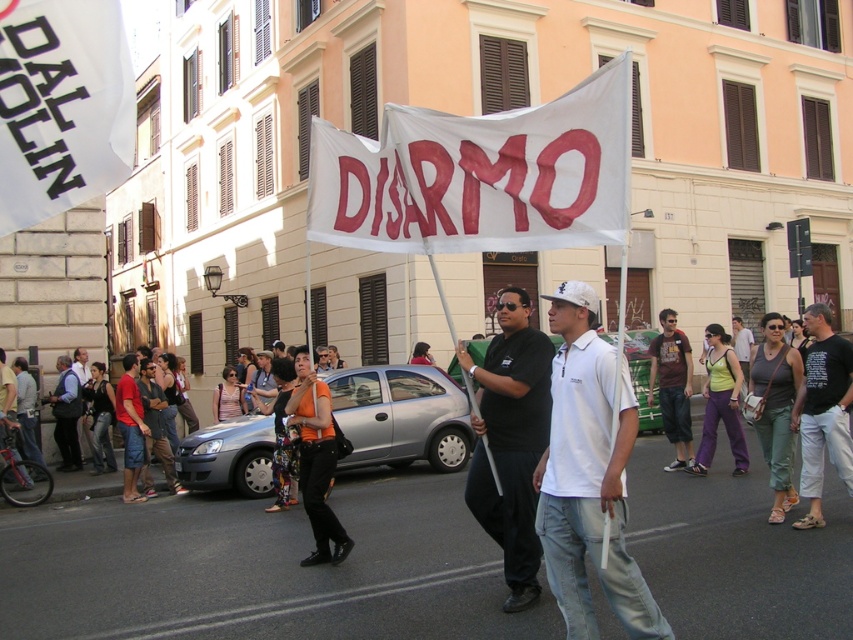
Is white matte polo shirt at center taller than black matte shirt at center?

No.

Between white matte polo shirt at center and black matte shirt at center, which one has more height?

With more height is black matte shirt at center.

Does point (641, 614) lie in front of point (488, 413)?

Yes.

Image resolution: width=853 pixels, height=640 pixels. I want to click on white matte polo shirt at center, so click(x=589, y=476).

Which is below, white fabric banner at center or brown fabric shirt at center?

brown fabric shirt at center

Describe the element at coordinates (479, 176) in the screenshot. I see `white fabric banner at center` at that location.

Between point (630, 68) and point (677, 445), which one is positioned behind?

Point (677, 445)

Where is `white fabric banner at center`? The height and width of the screenshot is (640, 853). white fabric banner at center is located at coordinates (479, 176).

Between matte black shirt at center and dark gray shirt at center, which one appears on the right side from the viewer's perspective?

matte black shirt at center

Can you confirm if matte black shirt at center is wider than dark gray shirt at center?

Indeed, matte black shirt at center has a greater width compared to dark gray shirt at center.

Is point (746, 355) positioned in front of point (74, 358)?

No, (746, 355) is behind (74, 358).

Where is `matte black shirt at center`? matte black shirt at center is located at coordinates (741, 348).